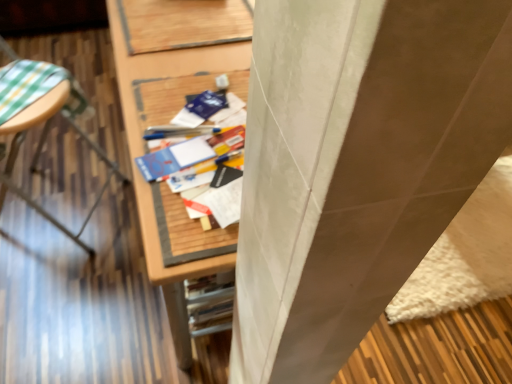
Question: In which direction should I rotate to look at wooden desk at center, which is counted as the first furniture, starting from the right?

Choices:
 (A) right
 (B) left

Answer: (B)

Question: From a real-world perspective, is wooden table at left, which is the second furniture from right to left, positioned under blue matte paper at center, which ranks as the 2th paperback book in front-to-back order, based on gravity?

Choices:
 (A) yes
 (B) no

Answer: (A)

Question: Is wooden table at left, which is the second furniture from right to left, shorter than blue matte paper at center, acting as the 1th paperback book starting from the back?

Choices:
 (A) yes
 (B) no

Answer: (B)

Question: Is wooden table at left, positioned as the 1th furniture in left-to-right order, smaller than blue matte paper at center, acting as the 1th paperback book starting from the back?

Choices:
 (A) yes
 (B) no

Answer: (B)

Question: Is wooden table at left, which is the second furniture from right to left, closer to the viewer compared to blue matte paper at center, acting as the 1th paperback book starting from the back?

Choices:
 (A) no
 (B) yes

Answer: (A)

Question: Is blue matte paper at center, which ranks as the 2th paperback book in front-to-back order, completely or partially inside wooden table at left, which is the second furniture from right to left?

Choices:
 (A) yes
 (B) no

Answer: (B)

Question: Considering the relative sizes of wooden table at left, positioned as the 1th furniture in left-to-right order, and blue matte paper at center, arranged as the second paperback book when ordered from the bottom, in the image provided, is wooden table at left, positioned as the 1th furniture in left-to-right order, taller than blue matte paper at center, arranged as the second paperback book when ordered from the bottom,?

Choices:
 (A) yes
 (B) no

Answer: (A)

Question: Is wooden table at left, positioned as the 1th furniture in left-to-right order, far away from wooden desk at center, which is counted as the first furniture, starting from the right?

Choices:
 (A) yes
 (B) no

Answer: (B)

Question: Is wooden table at left, positioned as the 1th furniture in left-to-right order, turned away from wooden desk at center, which is counted as the first furniture, starting from the right?

Choices:
 (A) yes
 (B) no

Answer: (B)

Question: Considering the relative positions of wooden table at left, positioned as the 1th furniture in left-to-right order, and wooden desk at center, acting as the 2th furniture starting from the left, in the image provided, is wooden table at left, positioned as the 1th furniture in left-to-right order, to the right of wooden desk at center, acting as the 2th furniture starting from the left, from the viewer's perspective?

Choices:
 (A) no
 (B) yes

Answer: (A)

Question: Does wooden table at left, positioned as the 1th furniture in left-to-right order, have a greater height compared to wooden desk at center, which is counted as the first furniture, starting from the right?

Choices:
 (A) no
 (B) yes

Answer: (B)

Question: Is wooden table at left, positioned as the 1th furniture in left-to-right order, wider than wooden desk at center, acting as the 2th furniture starting from the left?

Choices:
 (A) yes
 (B) no

Answer: (A)

Question: From a real-world perspective, is wooden table at left, which is the second furniture from right to left, over wooden desk at center, which is counted as the first furniture, starting from the right?

Choices:
 (A) no
 (B) yes

Answer: (B)

Question: Is wooden desk at center, acting as the 2th furniture starting from the left, thinner than matte blue paperback book at center, the 2th paperback book positioned from the top?

Choices:
 (A) yes
 (B) no

Answer: (B)